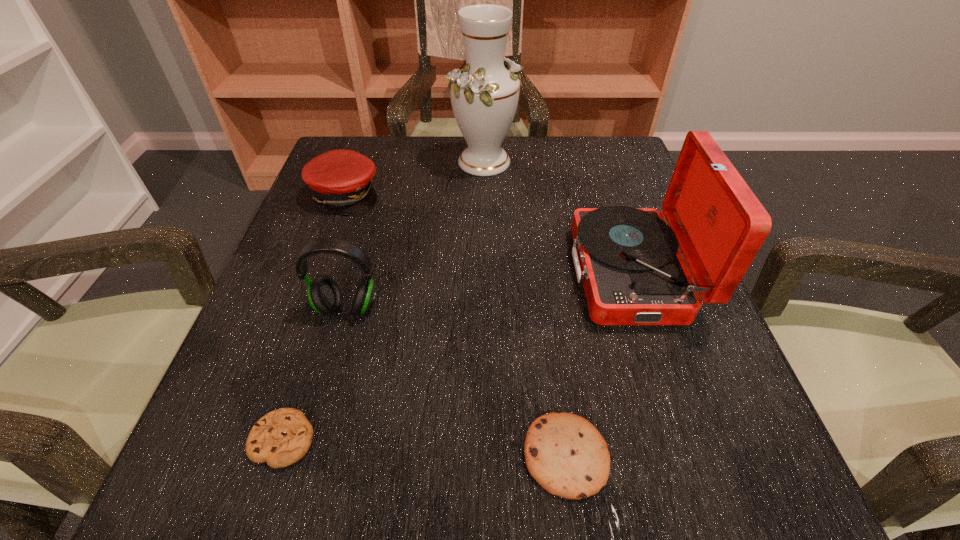
Identify the location of free spot between the taller cookie and the fourth shortest object. The image size is (960, 540). (456, 382).

Find the location of a particular element. object that is the closest to the shortest object is located at coordinates (324, 295).

Identify the location of object that is the closest to the shortest object. This screenshot has height=540, width=960. (324, 295).

What are the coordinates of `free space that satisfies the following two spatial constraints: 1. on the ear cups of the taller cookie; 2. on the right side of the fourth shortest object` in the screenshot? It's located at (307, 456).

Where is `free spot that satisfies the following two spatial constraints: 1. on the front-facing side of the left cookie; 2. on the right side of the cap`? The image size is (960, 540). free spot that satisfies the following two spatial constraints: 1. on the front-facing side of the left cookie; 2. on the right side of the cap is located at coordinates (256, 440).

Find the location of a particular element. This screenshot has width=960, height=540. free spot that satisfies the following two spatial constraints: 1. on the ear cups of the second shortest object; 2. on the right side of the headset is located at coordinates (307, 456).

Identify the location of blank space that satisfies the following two spatial constraints: 1. on the back side of the right cookie; 2. on the front-facing side of the fourth tallest object. The width and height of the screenshot is (960, 540). (531, 194).